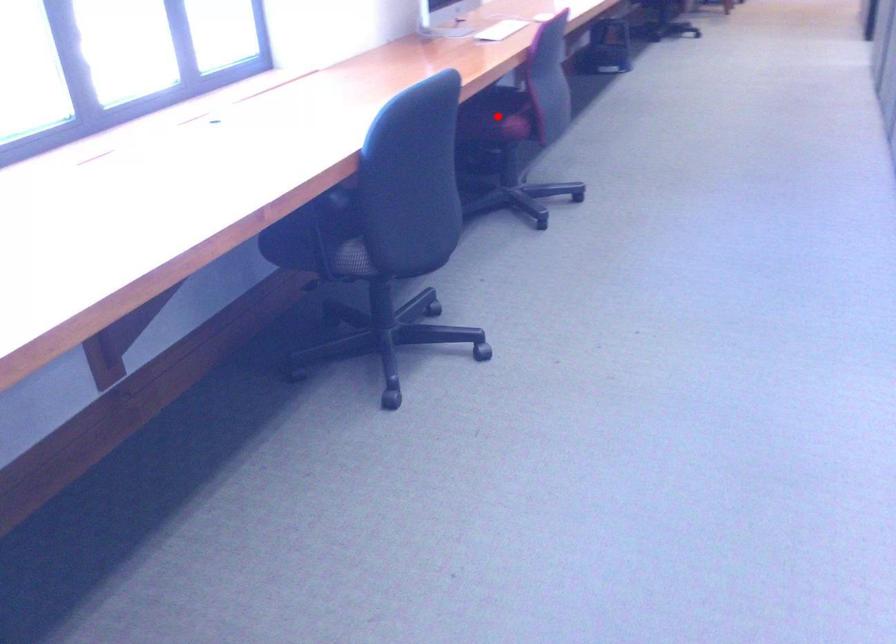
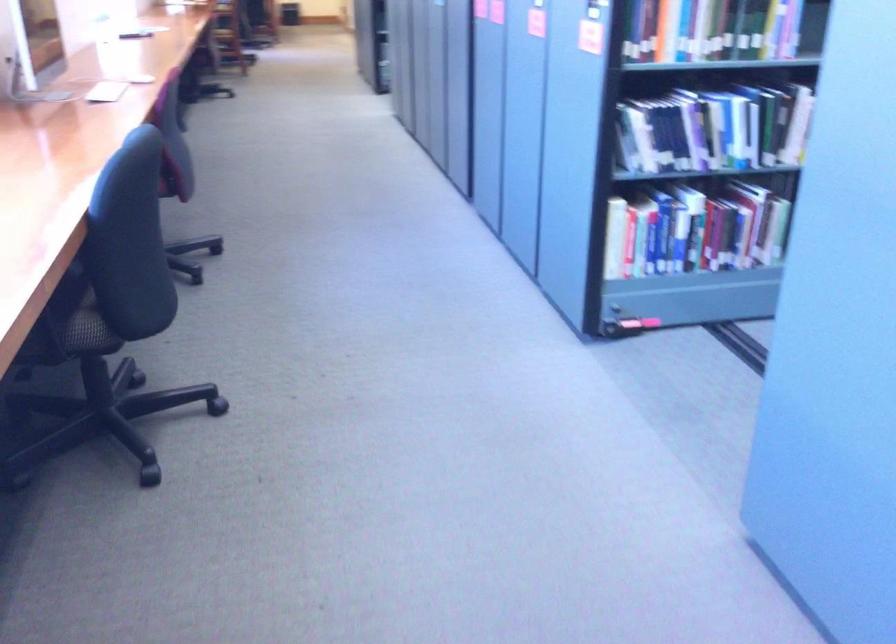
Question: I am providing you with two images of the same scene from different viewpoints. A red point is marked on the first image. At the location where the point appears in image 1, is it still visible in image 2?

Choices:
 (A) Yes
 (B) No

Answer: (B)